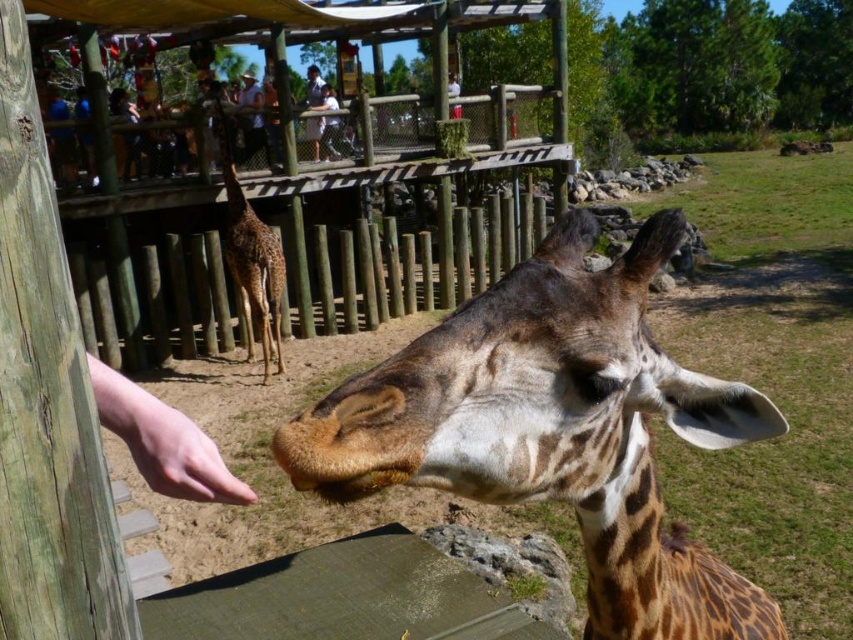
Question: Can you confirm if spotted fur giraffe at center is positioned to the left of spotted brown giraffe at center?

Choices:
 (A) yes
 (B) no

Answer: (B)

Question: Observing the image, what is the correct spatial positioning of brown textured tongue at center in reference to white fabric shirt at upper center?

Choices:
 (A) left
 (B) right

Answer: (B)

Question: Which object is the farthest from the white shirt at upper center?

Choices:
 (A) brown textured tongue at center
 (B) spotted brown giraffe at center
 (C) spotted fur giraffe at center

Answer: (A)

Question: Is pale skin/hairless hand at lower left smaller than white shirt at upper center?

Choices:
 (A) no
 (B) yes

Answer: (B)

Question: Which of these objects is positioned closest to the white fabric shirt at upper center?

Choices:
 (A) spotted fur giraffe at center
 (B) spotted brown giraffe at center
 (C) brown textured tongue at center
 (D) white shirt at upper center

Answer: (D)

Question: Considering the real-world distances, which object is farthest from the brown textured tongue at center?

Choices:
 (A) white fabric shirt at upper center
 (B) white shirt at upper center
 (C) pale skin/hairless hand at lower left

Answer: (A)